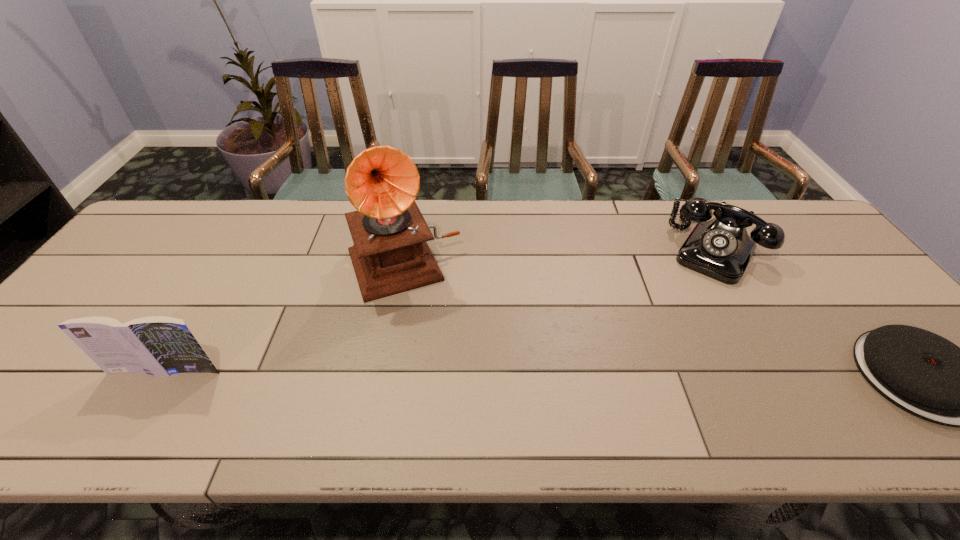
Locate an element on the screen. free space located 0.190m on the horn of the tallest object is located at coordinates (443, 355).

You are a GUI agent. You are given a task and a screenshot of the screen. Output one action in this format:
    pyautogui.click(x=<x>, y=<y>)
    Task: Click on the vacant region located on the horn of the tallest object
    The width and height of the screenshot is (960, 540).
    Given the screenshot: What is the action you would take?
    pyautogui.click(x=446, y=366)

Locate an element on the screen. The width and height of the screenshot is (960, 540). telephone present at the far edge is located at coordinates (720, 248).

This screenshot has width=960, height=540. Find the location of `phonograph record at the far edge`. phonograph record at the far edge is located at coordinates pyautogui.click(x=390, y=255).

Locate an element on the screen. This screenshot has width=960, height=540. object at the near edge is located at coordinates (157, 345).

In the image, there is a desktop. Identify the location of free space at the far edge. Image resolution: width=960 pixels, height=540 pixels. (278, 227).

At what (x,y) coordinates should I click in order to perform the action: click on vacant space at the near edge of the desktop. Please return your answer as a coordinate pair (x, y). Looking at the image, I should click on (159, 392).

Where is `free region at the far right corner of the desktop`? The image size is (960, 540). free region at the far right corner of the desktop is located at coordinates (754, 207).

Where is `vacant area that lies between the phonograph record and the third tallest object`? This screenshot has width=960, height=540. vacant area that lies between the phonograph record and the third tallest object is located at coordinates (559, 256).

Where is `free space between the third tallest object and the second object from left to right`? The width and height of the screenshot is (960, 540). free space between the third tallest object and the second object from left to right is located at coordinates (559, 256).